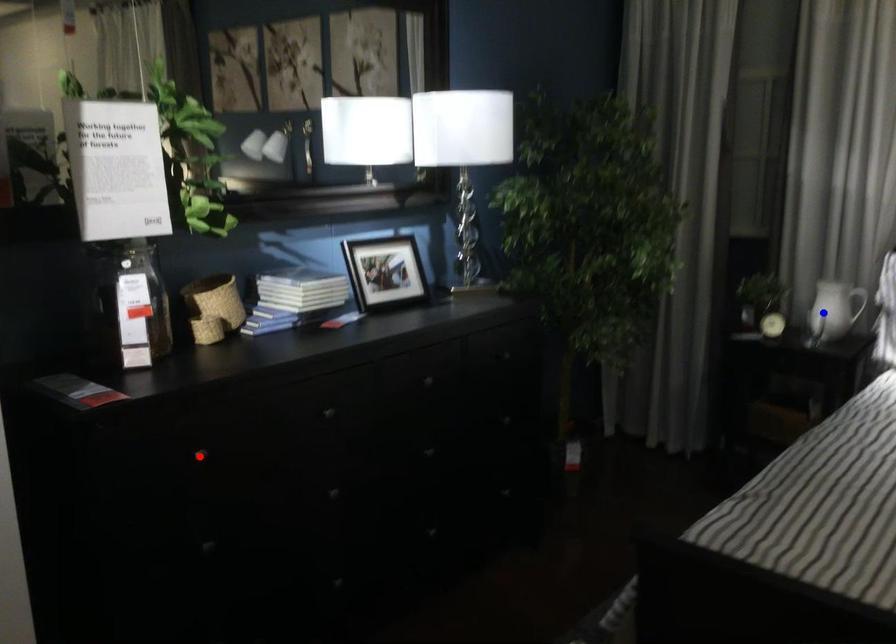
Question: In the image, two points are highlighted. Which point is nearer to the camera? Reply with the corresponding letter.

Choices:
 (A) blue point
 (B) red point

Answer: (B)